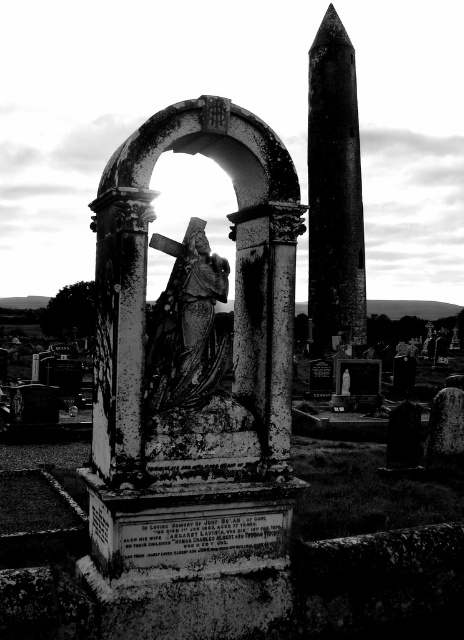
You are an archaeologist examining the cemetery scene. You need to locate the smooth stone pillar at upper right. According to the coordinates provided, where exactly is it positioned?

The smooth stone pillar at upper right is positioned at point (335, 188).